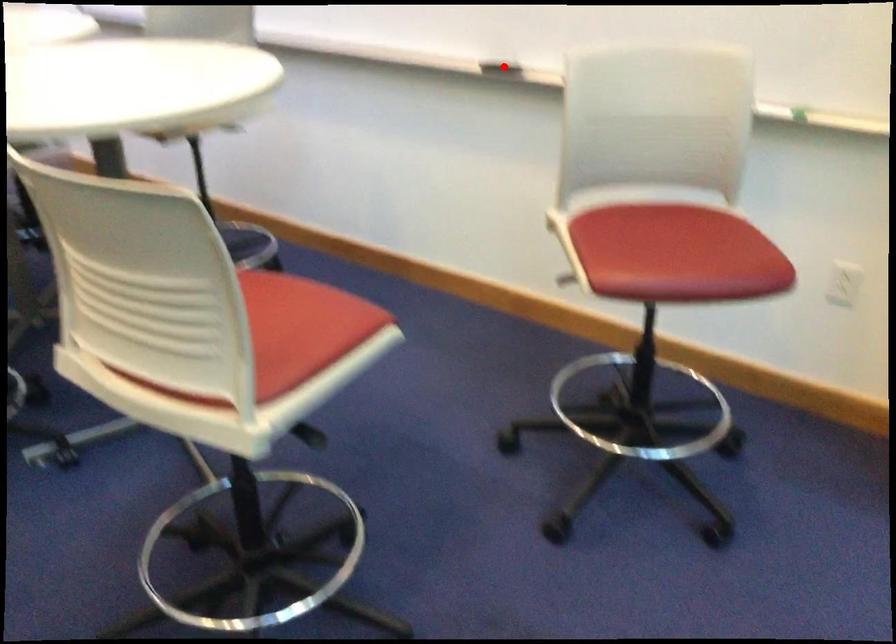
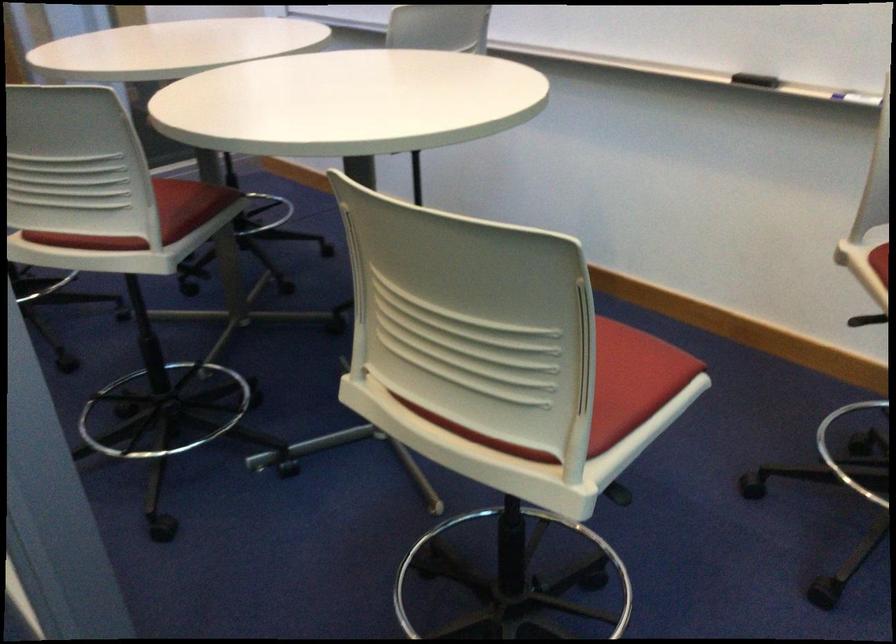
Find the pixel in the second image that matches the highlighted location in the first image.

(755, 80)